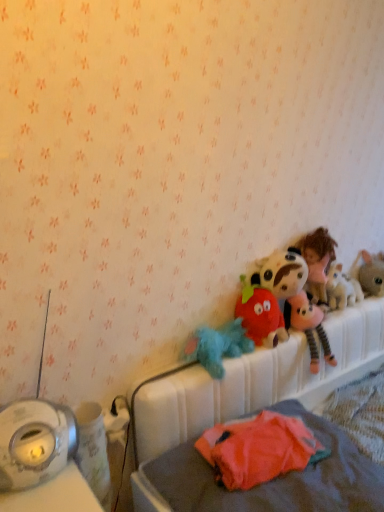
Question: Considering the positions of fluffy blue plush at center, placed as the first toy when sorted from left to right, and white plastic hospital bed at upper right in the image, is fluffy blue plush at center, placed as the first toy when sorted from left to right, wider or thinner than white plastic hospital bed at upper right?

Choices:
 (A) wide
 (B) thin

Answer: (B)

Question: Is fluffy blue plush at center, the fifth toy viewed from the right, to the left or to the right of white plastic hospital bed at upper right in the image?

Choices:
 (A) left
 (B) right

Answer: (A)

Question: Based on their relative distances, which object is nearer to the fluffy gray rabbit at right, which is the 1th toy in right-to-left order?

Choices:
 (A) orange fabric stuffed toy at lower right, the 4th toy positioned from the right
 (B) fluffy plush toy at upper right, which is the second toy from right to left
 (C) fluffy pink plush at upper right
 (D) white plastic hospital bed at upper right
 (E) fluffy blue plush at center, placed as the first toy when sorted from left to right

Answer: (B)

Question: Considering the real-world distances, which object is closest to the fluffy pink plush at upper right?

Choices:
 (A) fluffy plush toy at upper right, which is the second toy from right to left
 (B) orange fabric stuffed toy at lower right, the 4th toy positioned from the right
 (C) fluffy plush strawberry at center, arranged as the 3th toy when viewed from the right
 (D) white plastic hospital bed at upper right
 (E) fluffy blue plush at center, placed as the first toy when sorted from left to right

Answer: (A)